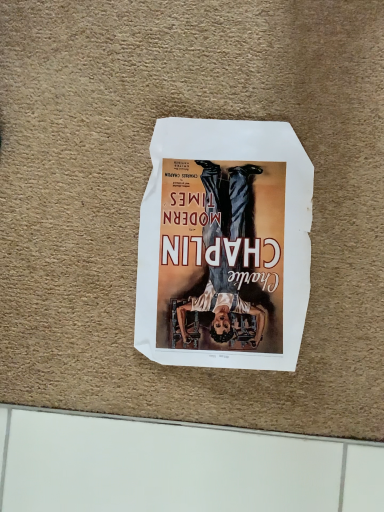
Identify the location of vacant area on top of matte paper poster at center (from a real-world perspective). The height and width of the screenshot is (512, 384). (220, 234).